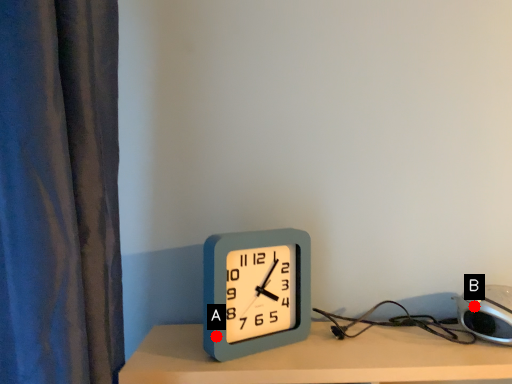
Question: Two points are circled on the image, labeled by A and B beside each circle. Among these points, which one is farthest from the camera?

Choices:
 (A) A is further
 (B) B is further

Answer: (B)